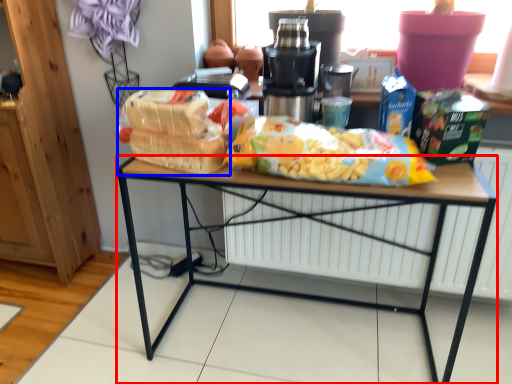
Question: Which object is further to the camera taking this photo, desk (highlighted by a red box) or snack (highlighted by a blue box)?

Choices:
 (A) desk
 (B) snack

Answer: (B)